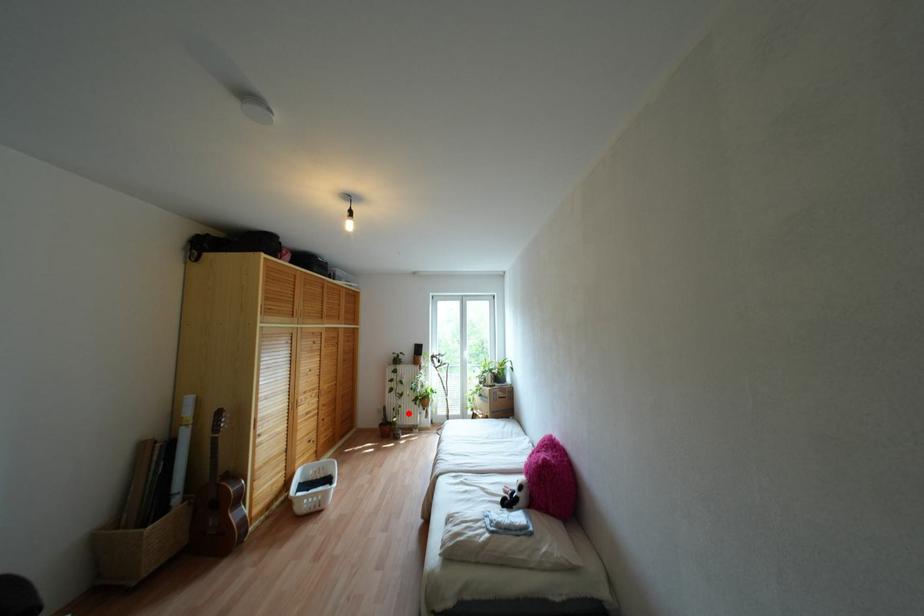
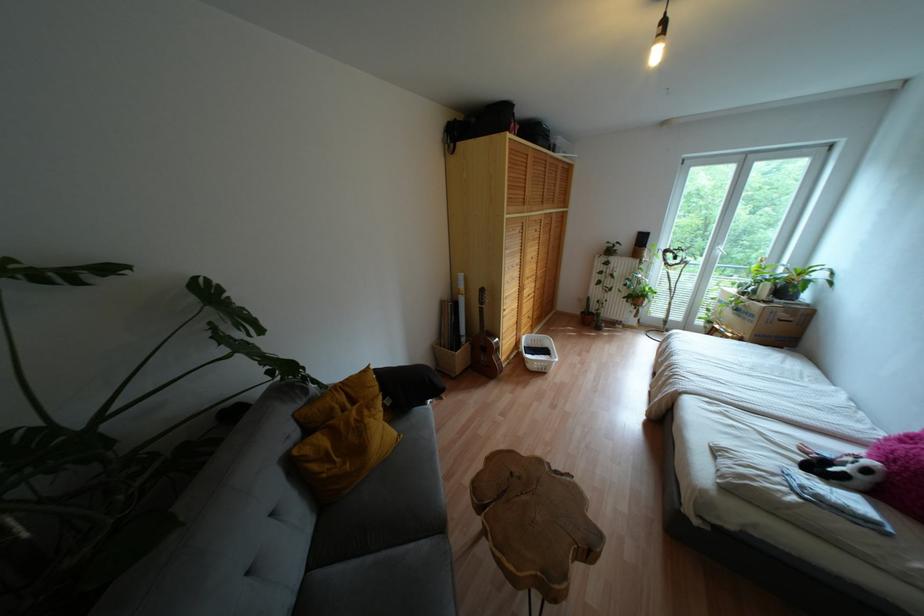
The point at the highlighted location is marked in the first image. Where is the corresponding point in the second image?

(614, 309)